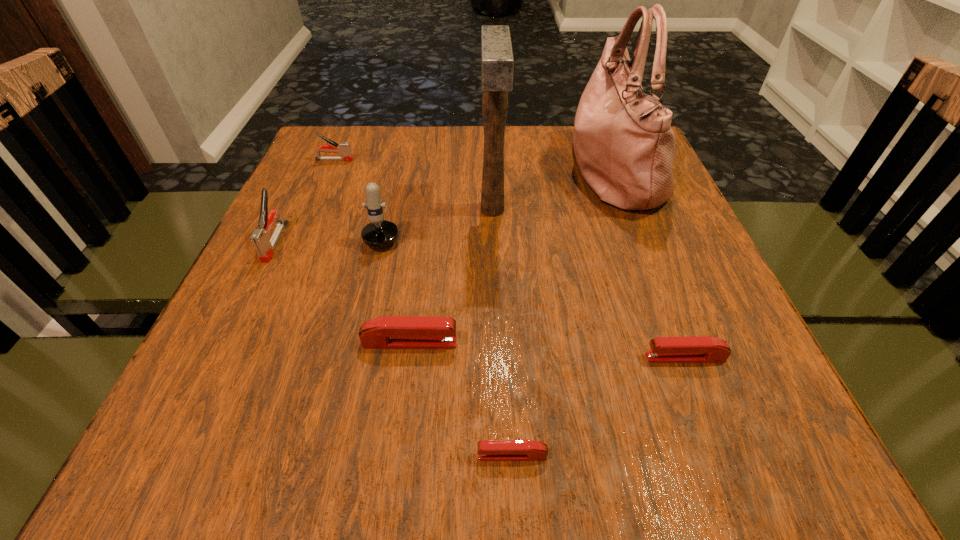
Locate an element on the screen. the rightmost stapler is located at coordinates (699, 349).

Where is `the second farthest red stapler`? the second farthest red stapler is located at coordinates click(x=699, y=349).

Where is `the shortest object`? the shortest object is located at coordinates (488, 450).

Where is `the second red stapler from right to left`? Image resolution: width=960 pixels, height=540 pixels. the second red stapler from right to left is located at coordinates (488, 450).

Find the location of a particular element. The width and height of the screenshot is (960, 540). free space located 0.240m at the front of the handbag with handles is located at coordinates (468, 170).

Where is `blank space located at the front of the handbag with handles`? blank space located at the front of the handbag with handles is located at coordinates (522, 170).

You are a GUI agent. You are given a task and a screenshot of the screen. Output one action in this format:
    pyautogui.click(x=<x>, y=<y>)
    Task: Click on the free location located at the front of the handbag with handles
    The image size is (960, 540).
    Given the screenshot: What is the action you would take?
    pyautogui.click(x=409, y=170)

Find the location of a particular element. The image size is (960, 540). free space located 0.100m on the front of the mallet is located at coordinates (494, 268).

The height and width of the screenshot is (540, 960). I want to click on vacant space located on the back of the sixth shortest object, so click(396, 182).

The width and height of the screenshot is (960, 540). I want to click on vacant region located on the handle side of the fourth tallest object, so click(x=231, y=330).